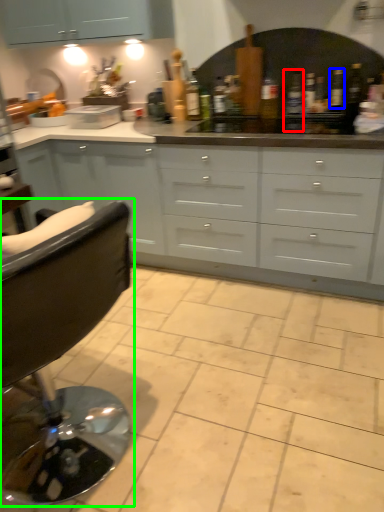
Question: Which is farther away from bottle (highlighted by a red box)? bottle (highlighted by a blue box) or chair (highlighted by a green box)?

Choices:
 (A) bottle
 (B) chair

Answer: (B)